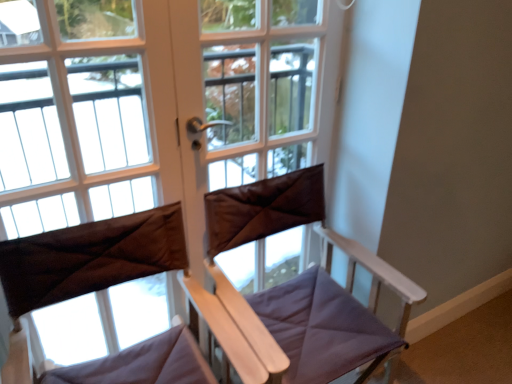
Question: Is brown leather screen door at center shorter than matte brown curtain at left?

Choices:
 (A) no
 (B) yes

Answer: (B)

Question: Does brown leather screen door at center come in front of matte brown curtain at left?

Choices:
 (A) yes
 (B) no

Answer: (B)

Question: Is brown leather screen door at center thinner than matte brown curtain at left?

Choices:
 (A) yes
 (B) no

Answer: (B)

Question: Is brown leather screen door at center to the left of matte brown curtain at left from the viewer's perspective?

Choices:
 (A) yes
 (B) no

Answer: (B)

Question: Considering the relative sizes of brown leather screen door at center and matte brown curtain at left in the image provided, is brown leather screen door at center bigger than matte brown curtain at left?

Choices:
 (A) no
 (B) yes

Answer: (B)

Question: Does brown leather screen door at center touch matte brown curtain at left?

Choices:
 (A) no
 (B) yes

Answer: (A)

Question: Is matte brown curtain at left far away from brown fabric at center?

Choices:
 (A) no
 (B) yes

Answer: (A)

Question: Does matte brown curtain at left have a larger size compared to brown fabric at center?

Choices:
 (A) no
 (B) yes

Answer: (A)

Question: Can you confirm if matte brown curtain at left is wider than brown fabric at center?

Choices:
 (A) no
 (B) yes

Answer: (A)

Question: From a real-world perspective, is matte brown curtain at left physically above brown fabric at center?

Choices:
 (A) no
 (B) yes

Answer: (A)

Question: Does matte brown curtain at left have a smaller size compared to brown fabric at center?

Choices:
 (A) no
 (B) yes

Answer: (B)

Question: Does matte brown curtain at left contain brown fabric at center?

Choices:
 (A) no
 (B) yes

Answer: (A)

Question: Does brown fabric at center touch brown fabric curtain at center?

Choices:
 (A) no
 (B) yes

Answer: (A)